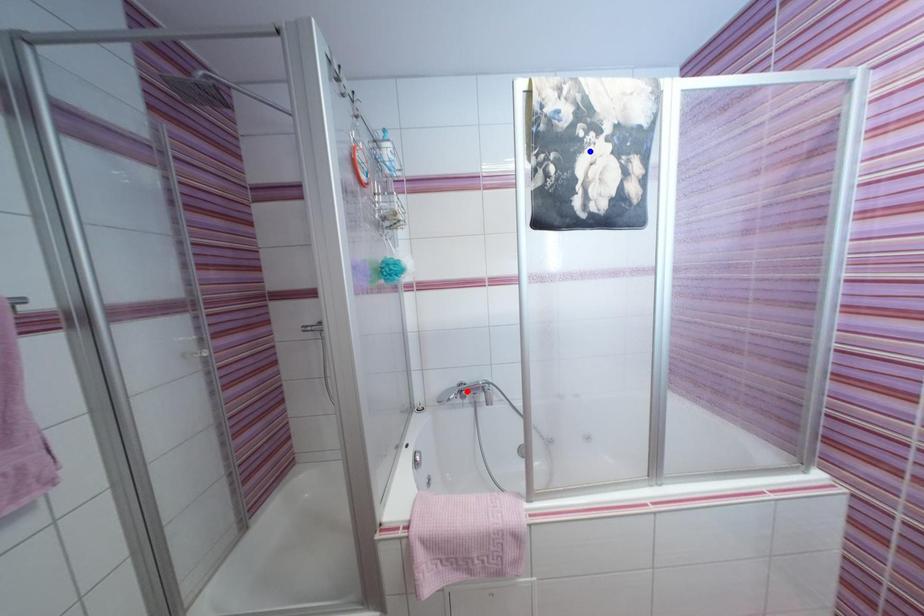
Question: Two points are marked on the image. Which point is closer to the camera?

Choices:
 (A) Blue point is closer.
 (B) Red point is closer.

Answer: (A)